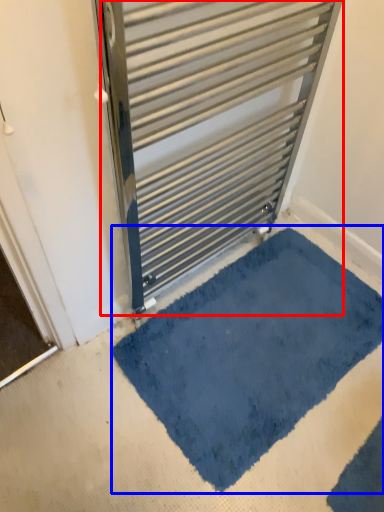
Question: Which of the following is the farthest to the observer, radiator (highlighted by a red box) or bath mat (highlighted by a blue box)?

Choices:
 (A) radiator
 (B) bath mat

Answer: (B)